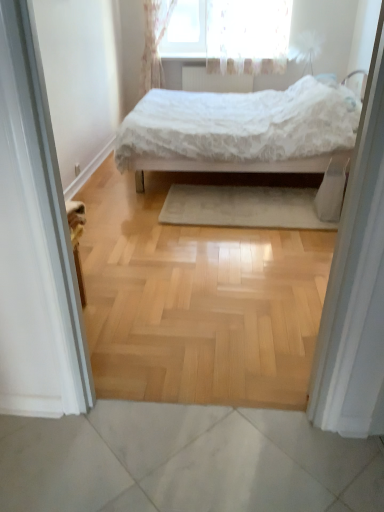
Question: Does white fabric screen door at right, positioned as the first screen door in right-to-left order, have a greater height compared to white lace curtain at upper center?

Choices:
 (A) yes
 (B) no

Answer: (A)

Question: From the image's perspective, does white fabric screen door at right, positioned as the first screen door in right-to-left order, appear higher than white lace curtain at upper center?

Choices:
 (A) no
 (B) yes

Answer: (A)

Question: From a real-world perspective, is white fabric screen door at right, positioned as the first screen door in right-to-left order, physically below white lace curtain at upper center?

Choices:
 (A) no
 (B) yes

Answer: (B)

Question: Is white fabric screen door at right, positioned as the first screen door in right-to-left order, shorter than white lace curtain at upper center?

Choices:
 (A) no
 (B) yes

Answer: (A)

Question: Is white fabric screen door at right, acting as the 2th screen door starting from the left, in contact with white lace curtain at upper center?

Choices:
 (A) no
 (B) yes

Answer: (A)

Question: Relative to white textured radiator at upper center, is white lace curtain at upper center in front or behind?

Choices:
 (A) front
 (B) behind

Answer: (A)

Question: From a real-world perspective, relative to white textured radiator at upper center, is white lace curtain at upper center vertically above or below?

Choices:
 (A) below
 (B) above

Answer: (B)

Question: Considering the positions of white lace curtain at upper center and white textured radiator at upper center in the image, is white lace curtain at upper center bigger or smaller than white textured radiator at upper center?

Choices:
 (A) small
 (B) big

Answer: (B)

Question: Looking at their shapes, would you say white lace curtain at upper center is wider or thinner than white textured radiator at upper center?

Choices:
 (A) wide
 (B) thin

Answer: (A)

Question: From the image's perspective, is beige soft rug at center above or below white textured radiator at upper center?

Choices:
 (A) above
 (B) below

Answer: (B)

Question: Is beige soft rug at center in front of or behind white textured radiator at upper center in the image?

Choices:
 (A) behind
 (B) front

Answer: (B)

Question: Is beige soft rug at center to the left or to the right of white textured radiator at upper center in the image?

Choices:
 (A) right
 (B) left

Answer: (A)

Question: From their relative heights in the image, would you say beige soft rug at center is taller or shorter than white textured radiator at upper center?

Choices:
 (A) tall
 (B) short

Answer: (B)

Question: Considering the positions of white fabric screen door at right, positioned as the first screen door in right-to-left order, and white lace curtain at upper center in the image, is white fabric screen door at right, positioned as the first screen door in right-to-left order, bigger or smaller than white lace curtain at upper center?

Choices:
 (A) big
 (B) small

Answer: (B)

Question: From a real-world perspective, relative to white lace curtain at upper center, is white fabric screen door at right, acting as the 2th screen door starting from the left, vertically above or below?

Choices:
 (A) below
 (B) above

Answer: (A)